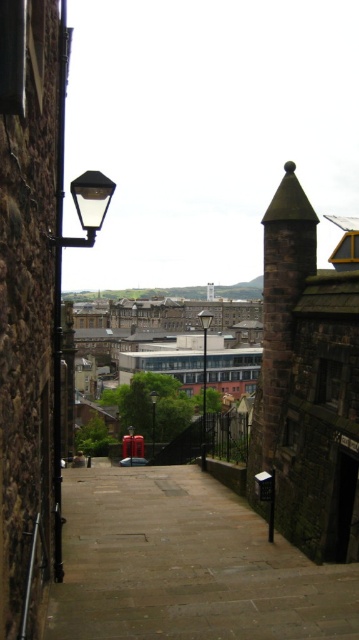
You are a delivery person trying to navigate through the narrow street. You need to place a large box on the ground. Considering the brown stone pavement at center and the matte black streetlamp at upper left, which surface can you use for placing the box?

The brown stone pavement at center has a smaller size compared to matte black streetlamp at upper left, so the matte black streetlamp at upper left is larger and more suitable for placing the large box.

You are a delivery person trying to navigate a narrow street with a tall box. You see the brown stone pavement at center and the matte black streetlamp at upper left. Which object is shorter in height?

The brown stone pavement at center is not as tall as matte black streetlamp at upper left, so the brown stone pavement at center is shorter in height.

Consider the image. You are standing at the entrance of the narrow stone street and want to reach a specific point marked at coordinates point (160, 540). Given that the street is only 10 feet wide, can you walk straight ahead without deviating from the center of the street to reach the point?

The point (160, 540) is 96.22 feet away from the viewer. Since the street is 10 feet wide, walking straight ahead in the center should allow you to reach the point without deviating, as the distance is sufficient and the width accommodates the path.